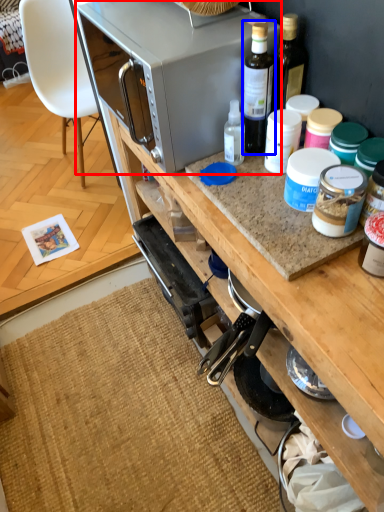
Question: Among these objects, which one is farthest to the camera, microwave oven (highlighted by a red box) or bottle (highlighted by a blue box)?

Choices:
 (A) microwave oven
 (B) bottle

Answer: (A)